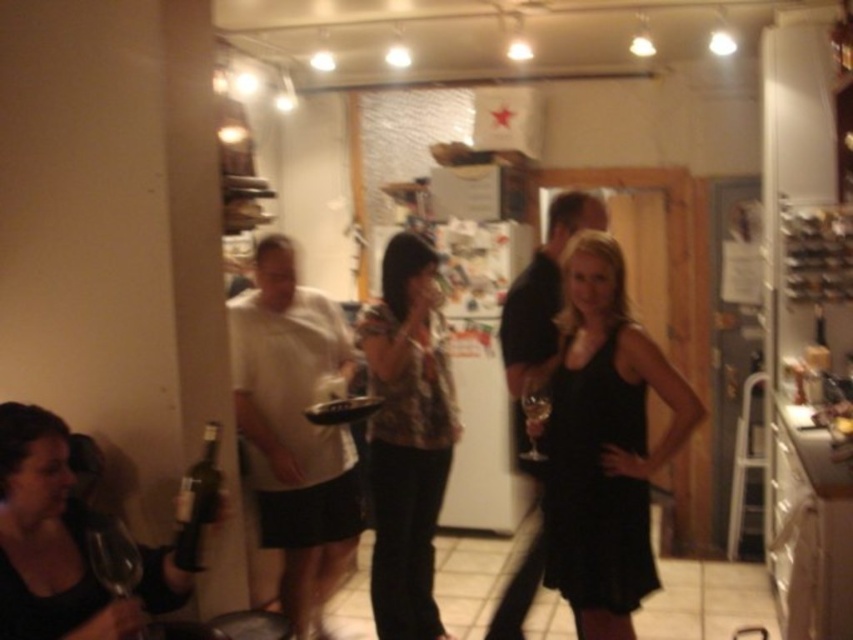
Image resolution: width=853 pixels, height=640 pixels. Describe the element at coordinates (604, 442) in the screenshot. I see `black satin dress at center` at that location.

Does black satin dress at center have a larger size compared to camouflage fabric shirt at center?

Yes, black satin dress at center is bigger than camouflage fabric shirt at center.

What do you see at coordinates (604, 442) in the screenshot? I see `black satin dress at center` at bounding box center [604, 442].

Locate an element on the screen. The width and height of the screenshot is (853, 640). black satin dress at center is located at coordinates 604,442.

Is point (268, 380) farther from viewer compared to point (548, 412)?

That is True.

Does white matte t-shirt at center have a greater width compared to translucent glass wine at center?

Yes.

Find the location of `white matte t-shirt at center`. white matte t-shirt at center is located at coordinates (294, 429).

Is dark red glass bottle at lower left shorter than transparent glass wine glass at center?

No.

Which is in front, point (187, 496) or point (543, 394)?

Positioned in front is point (187, 496).

Is point (207, 474) positioned in front of point (523, 387)?

Yes, point (207, 474) is in front of point (523, 387).

Image resolution: width=853 pixels, height=640 pixels. What are the coordinates of `dark red glass bottle at lower left` in the screenshot? It's located at (196, 500).